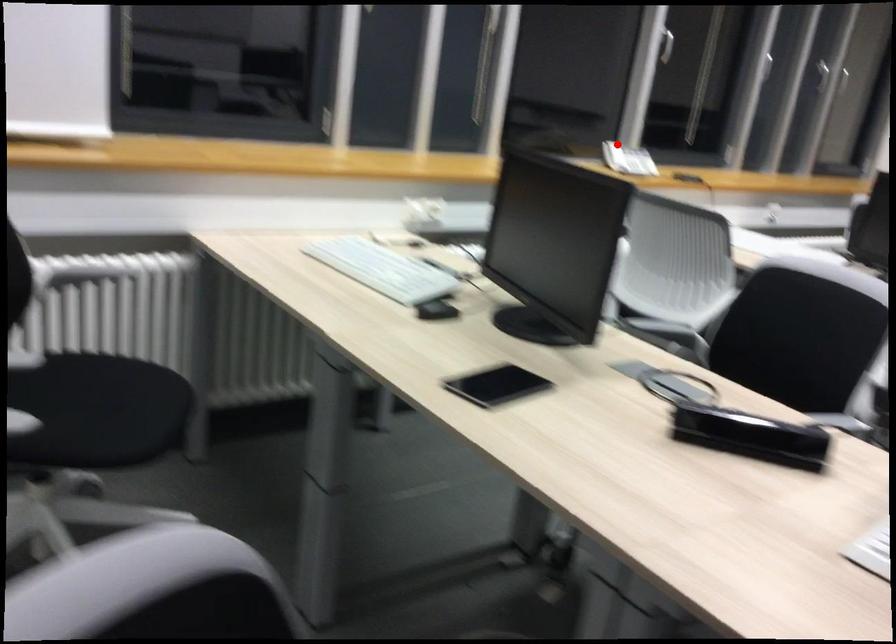
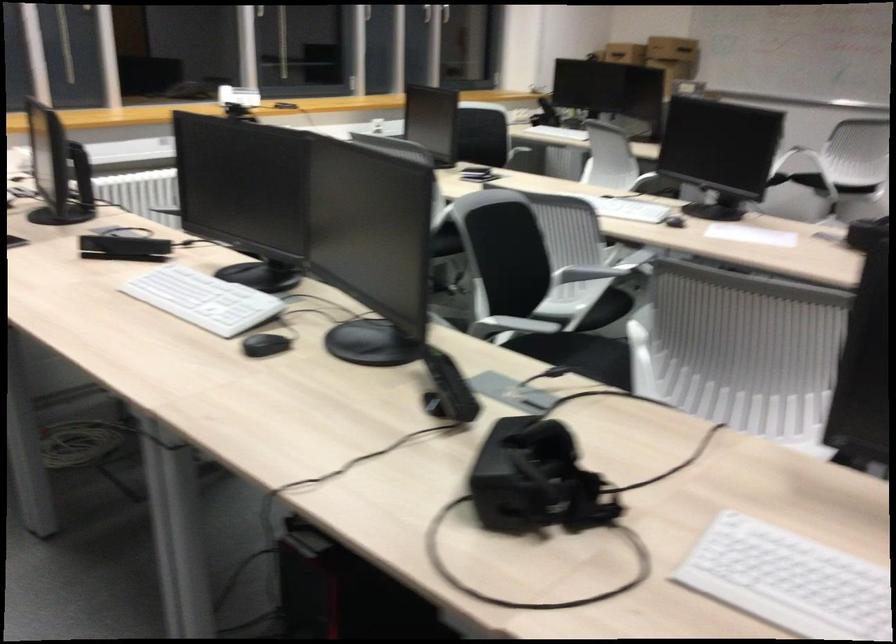
Where in the second image is the point corresponding to the highlighted location from the first image?

(238, 96)